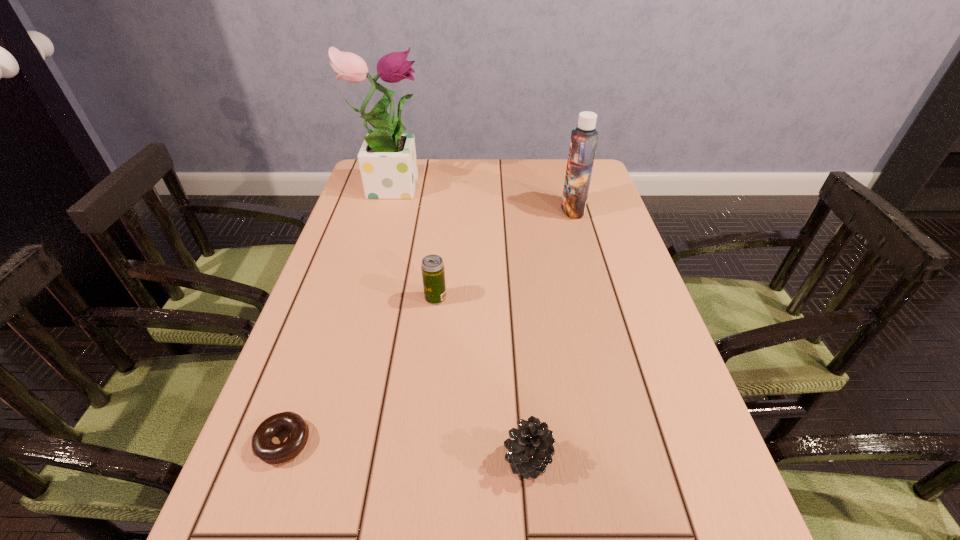
Identify the location of free space at the left edge of the desktop. (336, 253).

Identify the location of blank space at the right edge. (601, 276).

Find the location of a particular element. vacant space at the far right corner of the desktop is located at coordinates (606, 187).

This screenshot has width=960, height=540. What are the coordinates of `vacant point located between the shortest object and the rightmost object` in the screenshot? It's located at (428, 326).

Image resolution: width=960 pixels, height=540 pixels. What are the coordinates of `free point between the doughnut and the third farthest object` in the screenshot? It's located at (359, 370).

Image resolution: width=960 pixels, height=540 pixels. What are the coordinates of `vacant area that lies between the fourth object from left to right and the shortest object` in the screenshot? It's located at click(x=405, y=450).

I want to click on free space between the flower arrangement and the third object from left to right, so click(414, 241).

Find the location of `unoccupied area between the shortest object and the third object from right to left`. unoccupied area between the shortest object and the third object from right to left is located at coordinates (359, 370).

Find the location of `free spot between the shortest object and the second object from right to left`. free spot between the shortest object and the second object from right to left is located at coordinates tap(405, 450).

I want to click on free spot between the shampoo and the doughnut, so click(428, 326).